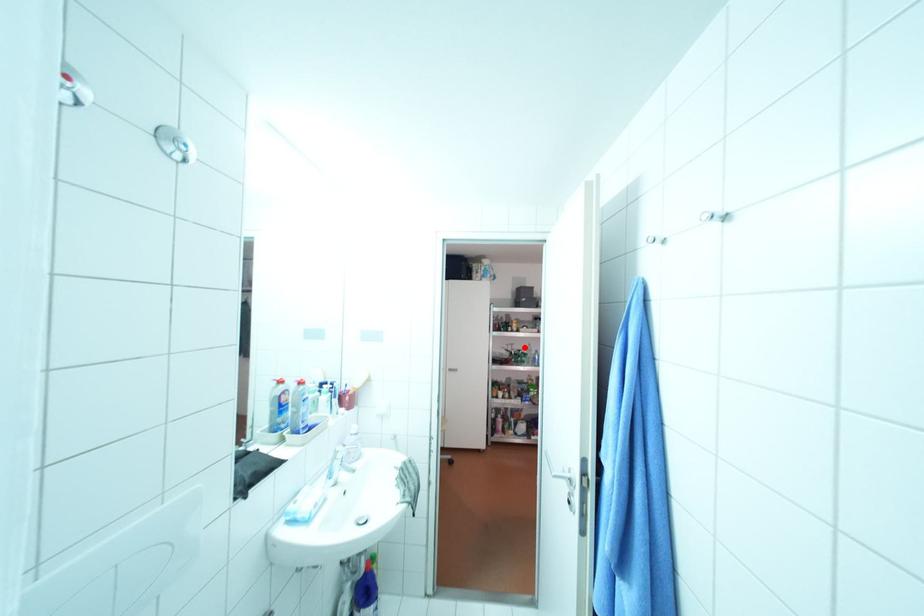
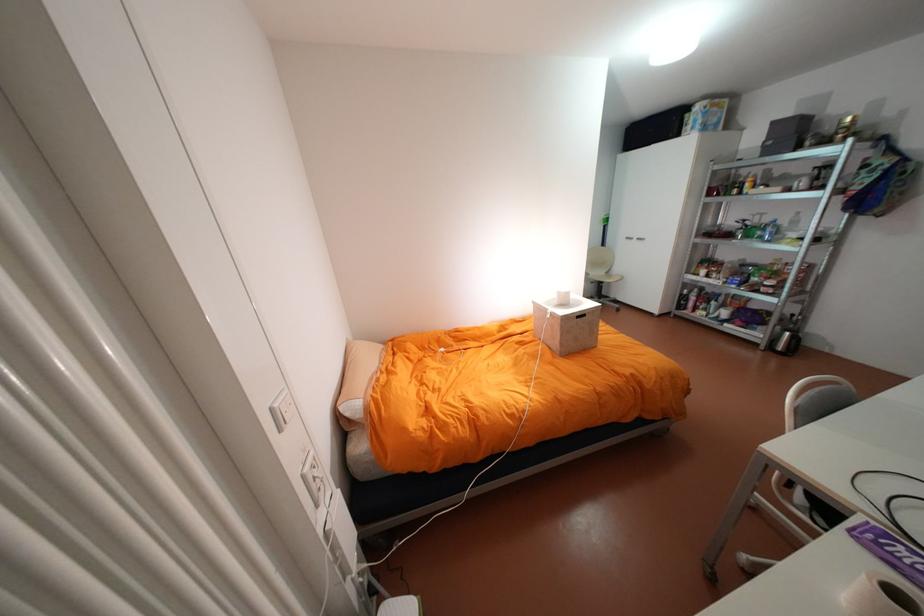
Where in the second image is the point corresponding to the highlighted location from the first image?

(775, 219)